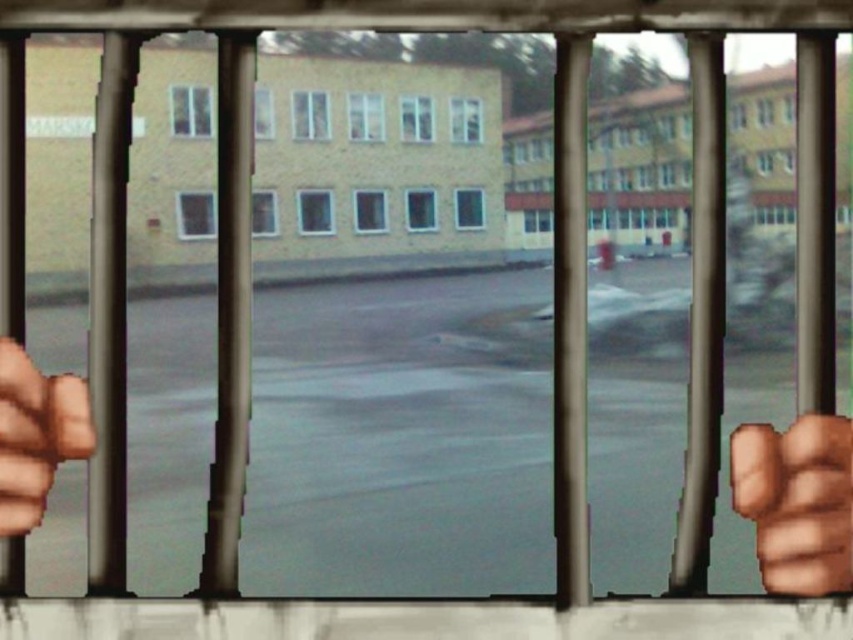
Question: Can you confirm if brown leather fist at right is thinner than brown leather hand at left?

Choices:
 (A) no
 (B) yes

Answer: (A)

Question: Considering the relative positions of brown leather fist at right and brown leather hand at left in the image provided, where is brown leather fist at right located with respect to brown leather hand at left?

Choices:
 (A) right
 (B) left

Answer: (A)

Question: Is brown leather fist at right to the right of brown leather hand at left from the viewer's perspective?

Choices:
 (A) no
 (B) yes

Answer: (B)

Question: Which object appears farthest from the camera in this image?

Choices:
 (A) brown leather fist at right
 (B) brown leather hand at left

Answer: (A)